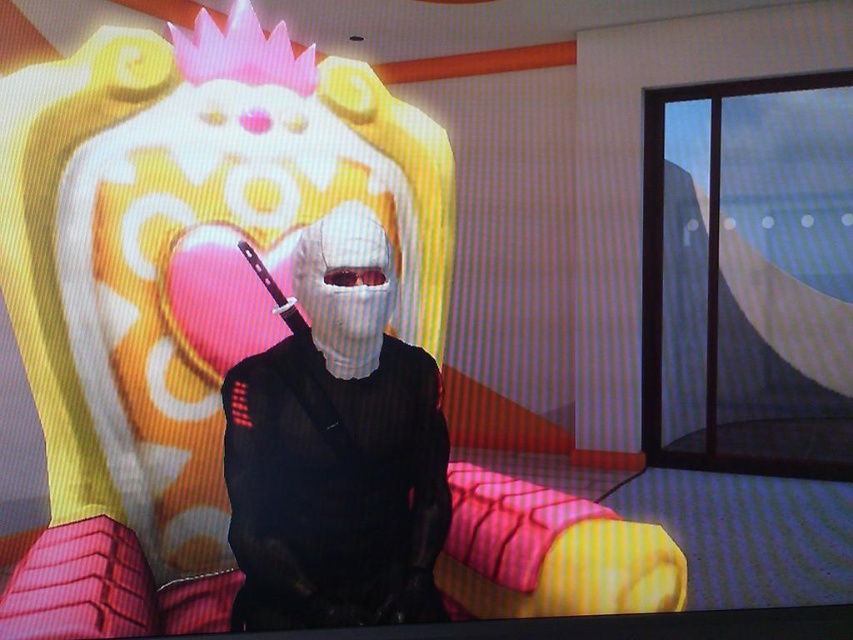
Question: Which point appears farthest from the camera in this image?

Choices:
 (A) (279, 292)
 (B) (311, 472)

Answer: (A)

Question: Does white matte mask at center appear on the left side of matte black knife at center?

Choices:
 (A) no
 (B) yes

Answer: (A)

Question: Does white matte mask at center have a lesser width compared to matte black knife at center?

Choices:
 (A) yes
 (B) no

Answer: (B)

Question: Is white matte mask at center smaller than matte black knife at center?

Choices:
 (A) no
 (B) yes

Answer: (A)